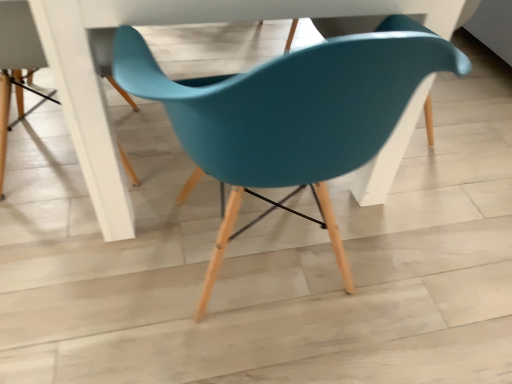
Locate an element on the screen. This screenshot has height=384, width=512. free spot below teal plastic chair at upper center, acting as the second chair starting from the right (from a real-world perspective) is located at coordinates (41, 161).